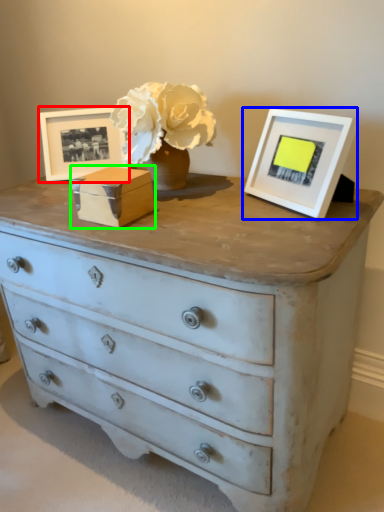
Question: Which object is positioned farthest from picture frame (highlighted by a red box)? Select from picture frame (highlighted by a blue box) and box (highlighted by a green box).

Choices:
 (A) picture frame
 (B) box

Answer: (A)